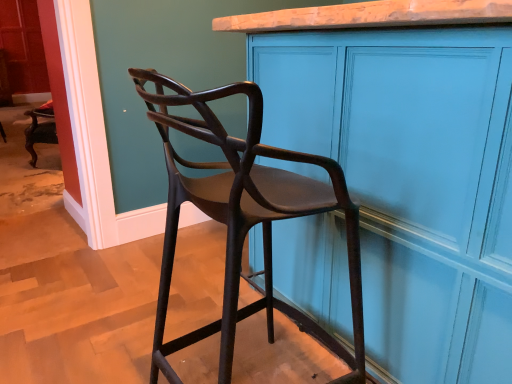
Identify the location of matte dark wood chair at center. Image resolution: width=512 pixels, height=384 pixels. (244, 218).

Describe the element at coordinates (244, 218) in the screenshot. I see `matte dark wood chair at center` at that location.

In order to face matte dark wood chair at center, should I rotate leftwards or rightwards?

Turn left by 1.546 degrees to look at matte dark wood chair at center.

Identify the location of matte dark wood chair at center. (244, 218).